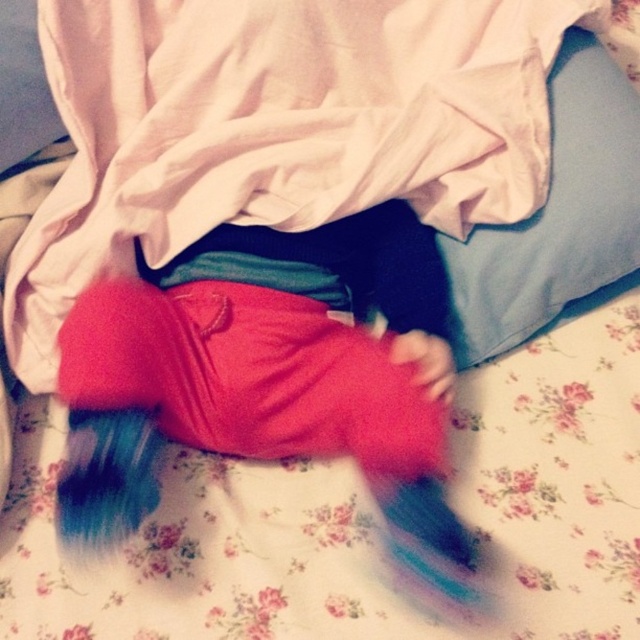
Where is `fluffy red pants at center`? This screenshot has height=640, width=640. fluffy red pants at center is located at coordinates (264, 376).

Is fluffy red pants at center positioned before light blue fabric pillow at upper right?

That is True.

Is point (61, 474) positioned after point (529, 218)?

No.

Image resolution: width=640 pixels, height=640 pixels. Find the location of `fluffy red pants at center`. fluffy red pants at center is located at coordinates click(264, 376).